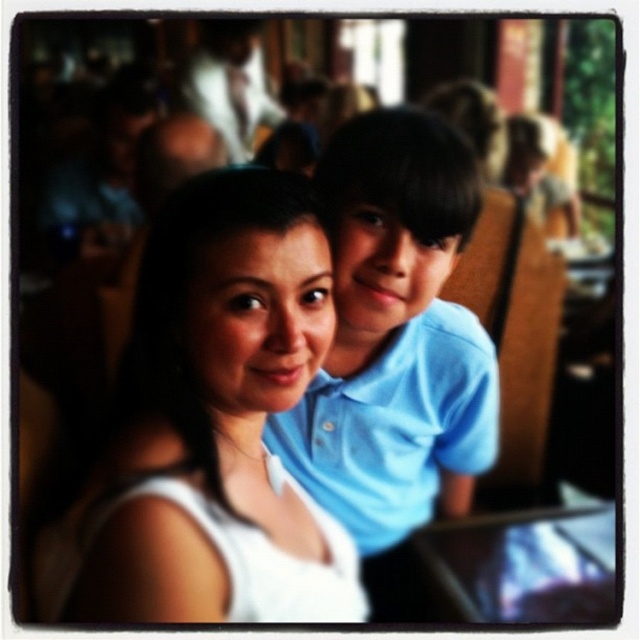
From the picture: Can you confirm if white matte tank top at center is positioned below metallic silver laptop at center?

Actually, white matte tank top at center is above metallic silver laptop at center.

What do you see at coordinates (220, 420) in the screenshot?
I see `white matte tank top at center` at bounding box center [220, 420].

In order to click on white matte tank top at center in this screenshot , I will do `click(220, 420)`.

I want to click on white matte tank top at center, so pos(220,420).

Which is in front, point (397, 252) or point (259, 74)?

Point (397, 252) is more forward.

Is blue cotton shirt at center taller than white fabric at upper center?

Indeed, blue cotton shirt at center has a greater height compared to white fabric at upper center.

Is point (360, 141) closer to viewer compared to point (252, 54)?

That is False.

Where is `blue cotton shirt at center`? The width and height of the screenshot is (640, 640). blue cotton shirt at center is located at coordinates (394, 333).

Describe the element at coordinates (524, 564) in the screenshot. I see `metallic silver laptop at center` at that location.

Who is lower down, metallic silver laptop at center or white fabric at upper center?

metallic silver laptop at center is lower down.

Image resolution: width=640 pixels, height=640 pixels. In order to click on metallic silver laptop at center in this screenshot , I will do `click(524, 564)`.